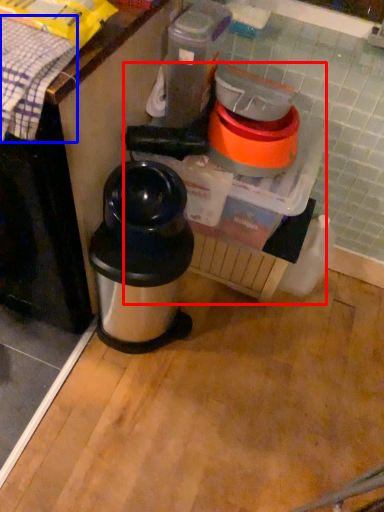
Question: Which of the following is the closest to the observer, blender (highlighted by a red box) or blanket (highlighted by a blue box)?

Choices:
 (A) blender
 (B) blanket

Answer: (B)